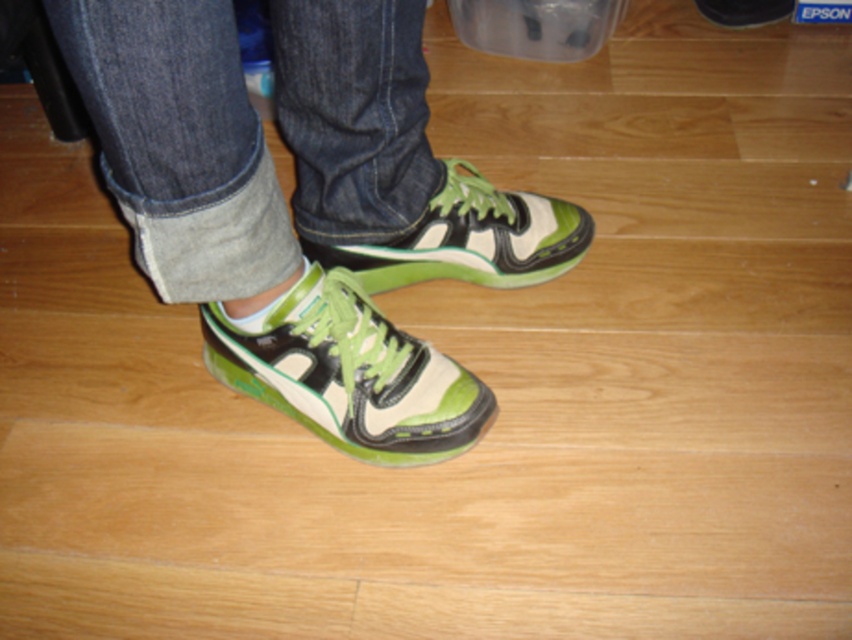
Who is higher up, green matte sneakers at center or green matte/suede sneaker at center?

green matte sneakers at center

Where is `green matte sneakers at center`? The width and height of the screenshot is (852, 640). green matte sneakers at center is located at coordinates (304, 208).

Find the location of a particular element. This screenshot has width=852, height=640. green matte sneakers at center is located at coordinates (304, 208).

Can you confirm if green matte sneakers at center is positioned to the right of green matte/suede sneaker at lower center?

No, green matte sneakers at center is not to the right of green matte/suede sneaker at lower center.

Can you confirm if green matte sneakers at center is smaller than green matte/suede sneaker at lower center?

No.

Does point (306, 1) come in front of point (376, 404)?

Yes.

The height and width of the screenshot is (640, 852). I want to click on green matte sneakers at center, so click(x=304, y=208).

Does green matte/suede sneaker at lower center have a greater width compared to green matte/suede sneaker at center?

No.

Which is below, green matte/suede sneaker at lower center or green matte/suede sneaker at center?

green matte/suede sneaker at lower center is lower down.

Which is in front, point (376, 368) or point (531, 252)?

Point (376, 368)

At what (x,y) coordinates should I click in order to perform the action: click on green matte/suede sneaker at lower center. Please return your answer as a coordinate pair (x, y). Image resolution: width=852 pixels, height=640 pixels. Looking at the image, I should click on (349, 372).